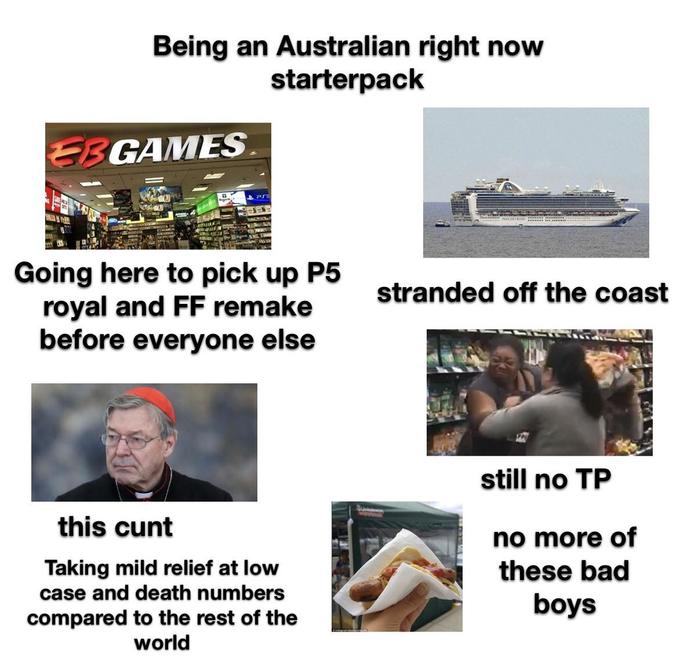
Identify the location of lights. This screenshot has width=680, height=660. (205, 177), (162, 181).